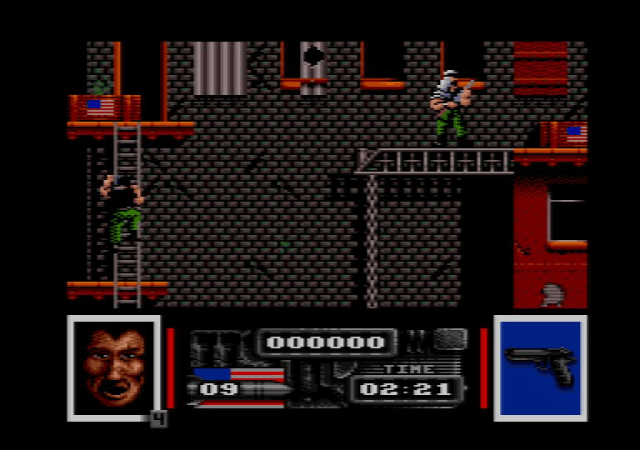
Image resolution: width=640 pixels, height=450 pixels. In order to click on ladder step in this screenshot , I will do `click(124, 304)`, `click(125, 289)`, `click(125, 275)`, `click(128, 263)`, `click(128, 247)`, `click(125, 236)`, `click(131, 169)`, `click(128, 157)`, `click(128, 138)`, `click(128, 125)`.